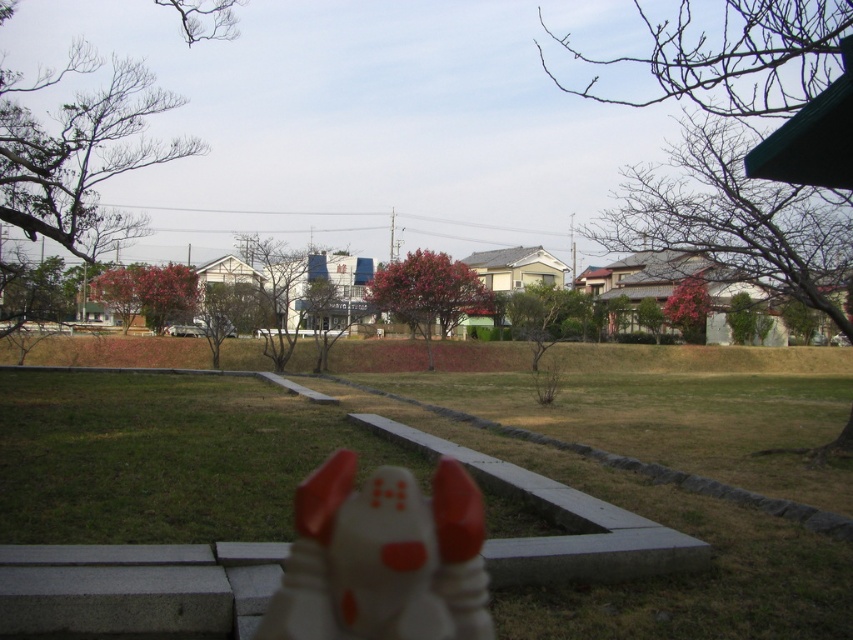
Is green grass at center above white matte dog at center?

Indeed, green grass at center is positioned over white matte dog at center.

Is green grass at center to the left of white matte dog at center from the viewer's perspective?

Yes, green grass at center is to the left of white matte dog at center.

Is point (352, 445) less distant than point (303, 536)?

No, it is not.

Identify the location of green grass at center. Image resolution: width=853 pixels, height=640 pixels. (364, 472).